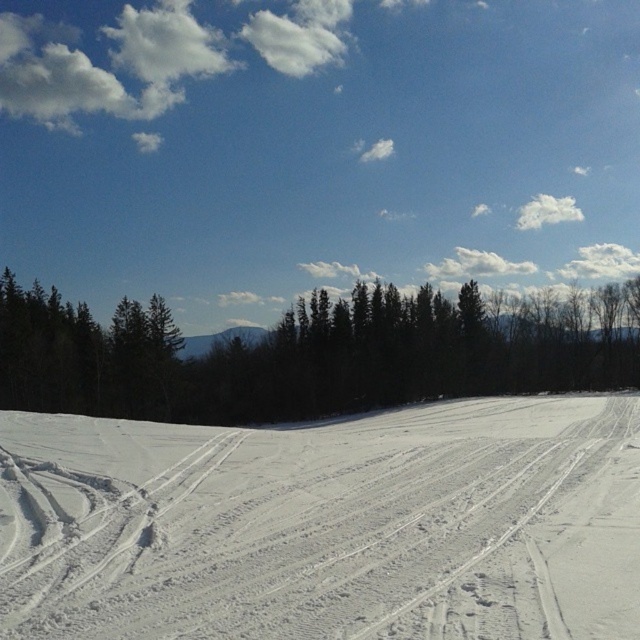
How distant is white powdery snow at center from green matte trees at center?

white powdery snow at center and green matte trees at center are 102.94 meters apart from each other.

Find the location of a particular element. The width and height of the screenshot is (640, 640). white powdery snow at center is located at coordinates (326, 524).

What do you see at coordinates (326, 524) in the screenshot? I see `white powdery snow at center` at bounding box center [326, 524].

The image size is (640, 640). What are the coordinates of `white powdery snow at center` in the screenshot? It's located at (326, 524).